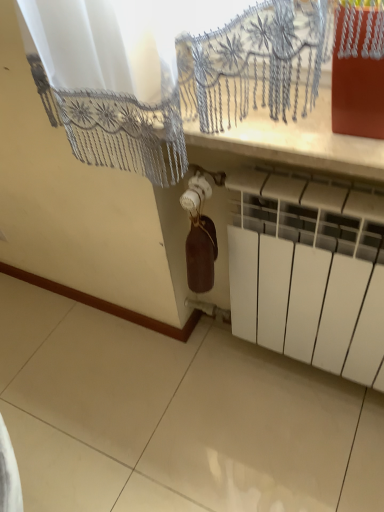
The height and width of the screenshot is (512, 384). I want to click on brown matte wine bottle at center, so click(201, 254).

The height and width of the screenshot is (512, 384). What do you see at coordinates (201, 254) in the screenshot?
I see `brown matte wine bottle at center` at bounding box center [201, 254].

The width and height of the screenshot is (384, 512). What do you see at coordinates (310, 279) in the screenshot?
I see `white matte radiator at lower right` at bounding box center [310, 279].

Where is `white matte radiator at lower right`? Image resolution: width=384 pixels, height=512 pixels. white matte radiator at lower right is located at coordinates (310, 279).

Based on the photo, in order to face white matte radiator at lower right, should I rotate leftwards or rightwards?

Turn right by 12.599 degrees to look at white matte radiator at lower right.

Find the location of a particular element. brown matte wine bottle at center is located at coordinates (201, 254).

Which object is positioned more to the right, white matte radiator at lower right or brown matte wine bottle at center?

From the viewer's perspective, white matte radiator at lower right appears more on the right side.

Which object is closer to the camera taking this photo, white matte radiator at lower right or brown matte wine bottle at center?

white matte radiator at lower right.

Does point (272, 337) come farther from viewer compared to point (210, 220)?

Yes, it is behind point (210, 220).

In the scene shown: From the image's perspective, is white matte radiator at lower right over brown matte wine bottle at center?

No, from the image's perspective, white matte radiator at lower right is not over brown matte wine bottle at center.

From a real-world perspective, between white matte radiator at lower right and brown matte wine bottle at center, who is vertically higher?

brown matte wine bottle at center, from a real-world perspective.

Considering the sizes of objects white matte radiator at lower right and brown matte wine bottle at center in the image provided, who is wider, white matte radiator at lower right or brown matte wine bottle at center?

Wider between the two is white matte radiator at lower right.

Consider the image. Is white matte radiator at lower right taller or shorter than brown matte wine bottle at center?

In the image, white matte radiator at lower right appears to be taller than brown matte wine bottle at center.

Is white matte radiator at lower right smaller than brown matte wine bottle at center?

Incorrect, white matte radiator at lower right is not smaller in size than brown matte wine bottle at center.

Is white matte radiator at lower right inside the boundaries of brown matte wine bottle at center, or outside?

white matte radiator at lower right is not inside brown matte wine bottle at center, it's outside.

Does white matte radiator at lower right touch brown matte wine bottle at center?

white matte radiator at lower right is not next to brown matte wine bottle at center, and they're not touching.

Could you tell me if white matte radiator at lower right is turned towards brown matte wine bottle at center?

Yes.

How different are the orientations of white matte radiator at lower right and brown matte wine bottle at center in degrees?

There is a 3.54-degree angle between the facing directions of white matte radiator at lower right and brown matte wine bottle at center.

Where is `radiator on the right of brown matte wine bottle at center`? The width and height of the screenshot is (384, 512). radiator on the right of brown matte wine bottle at center is located at coordinates (310, 279).

Which is more to the left, brown matte wine bottle at center or white matte radiator at lower right?

brown matte wine bottle at center.

Considering the relative positions of brown matte wine bottle at center and white matte radiator at lower right in the image provided, is brown matte wine bottle at center in front of white matte radiator at lower right?

No, it is not.

Is point (199, 225) positioned in front of point (380, 342)?

That is True.

From the image's perspective, is brown matte wine bottle at center positioned above or below white matte radiator at lower right?

From the image's perspective, brown matte wine bottle at center appears above white matte radiator at lower right.

Consider the image. From a real-world perspective, is brown matte wine bottle at center physically below white matte radiator at lower right?

No, from a real-world perspective, brown matte wine bottle at center is not below white matte radiator at lower right.

Which object is thinner, brown matte wine bottle at center or white matte radiator at lower right?

Thinner between the two is brown matte wine bottle at center.

Can you confirm if brown matte wine bottle at center is taller than white matte radiator at lower right?

No.

Is brown matte wine bottle at center bigger or smaller than white matte radiator at lower right?

Considering their sizes, brown matte wine bottle at center takes up less space than white matte radiator at lower right.

Is white matte radiator at lower right inside brown matte wine bottle at center?

Actually, white matte radiator at lower right is outside brown matte wine bottle at center.

Is there a large distance between brown matte wine bottle at center and white matte radiator at lower right?

No, there isn't a large distance between brown matte wine bottle at center and white matte radiator at lower right.

Could you tell me if brown matte wine bottle at center is turned towards white matte radiator at lower right?

Yes, brown matte wine bottle at center faces towards white matte radiator at lower right.

How many degrees apart are the facing directions of brown matte wine bottle at center and white matte radiator at lower right?

The angle between the facing direction of brown matte wine bottle at center and the facing direction of white matte radiator at lower right is 3.54 degrees.

How much distance is there between brown matte wine bottle at center and white matte radiator at lower right?

They are 9.11 inches apart.

Find the location of a particular element. radiator below the brown matte wine bottle at center (from the image's perspective) is located at coordinates (310, 279).

The height and width of the screenshot is (512, 384). Find the location of `wine bottle lying behind the white matte radiator at lower right`. wine bottle lying behind the white matte radiator at lower right is located at coordinates (201, 254).

The width and height of the screenshot is (384, 512). Find the location of `wine bottle above the white matte radiator at lower right (from a real-world perspective)`. wine bottle above the white matte radiator at lower right (from a real-world perspective) is located at coordinates point(201,254).